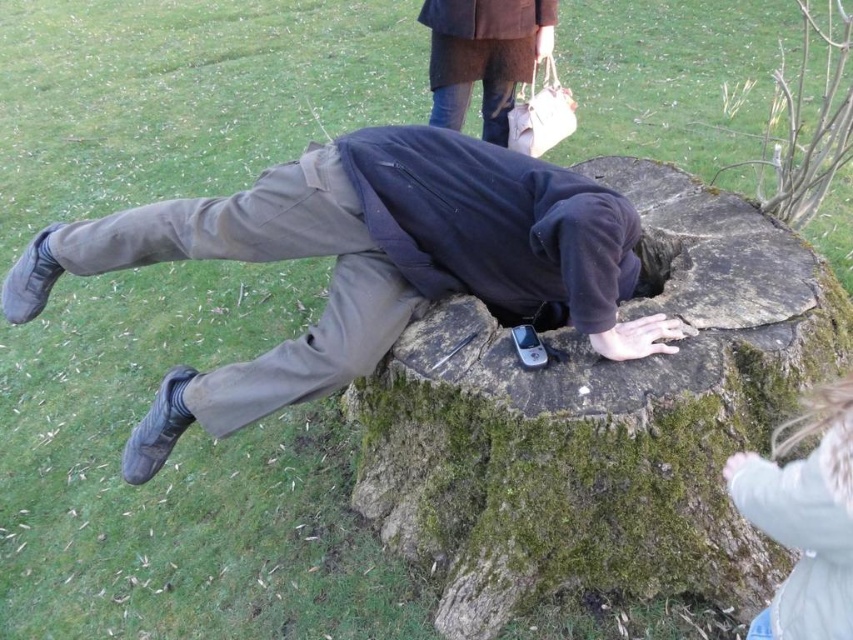
Between mossy bark stump at center and light blue fleece jacket at lower right, which one is positioned higher?

Positioned higher is mossy bark stump at center.

Who is taller, mossy bark stump at center or light blue fleece jacket at lower right?

mossy bark stump at center is taller.

Locate an element on the screen. mossy bark stump at center is located at coordinates (601, 424).

Can you confirm if dark blue fleece at center is thinner than light blue fleece jacket at lower right?

In fact, dark blue fleece at center might be wider than light blue fleece jacket at lower right.

Does point (300, 193) come behind point (843, 547)?

That is True.

Who is more forward, [479,157] or [799,609]?

Point [799,609]

At what (x,y) coordinates should I click in order to perform the action: click on dark blue fleece at center. Please return your answer as a coordinate pair (x, y). This screenshot has height=640, width=853. Looking at the image, I should click on (369, 262).

Does mossy bark stump at center appear under dark blue fleece at center?

Yes.

Which of these two, mossy bark stump at center or dark blue fleece at center, stands shorter?

dark blue fleece at center is shorter.

Who is more forward, (715, 547) or (496, 316)?

Point (715, 547) is more forward.

This screenshot has height=640, width=853. I want to click on mossy bark stump at center, so click(x=601, y=424).